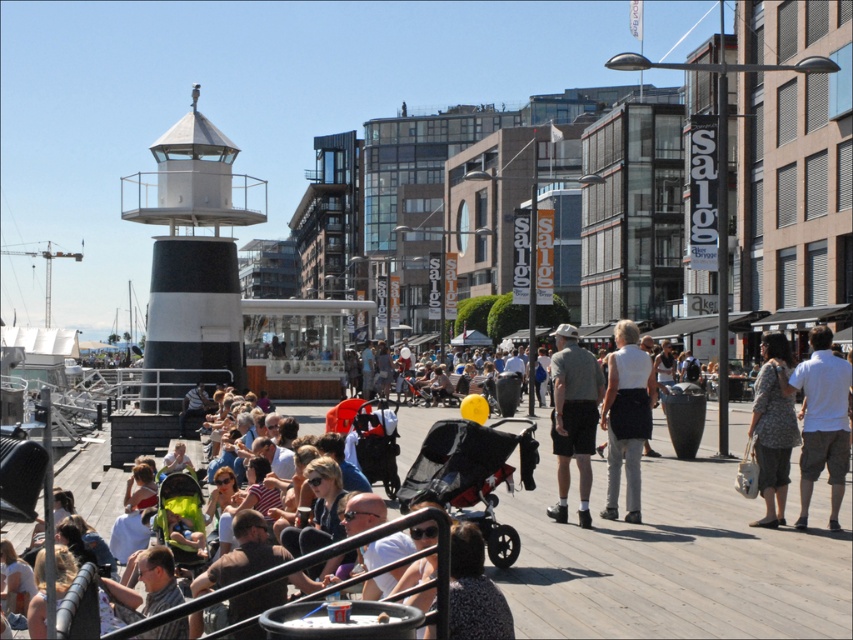
You are standing at point (821, 419) and see a white cotton shirt at center. Is there any object between you and the white cotton shirt at center?

There is no object between you and the white cotton shirt at center because you are already at the point where the white cotton shirt at center is located.

You are a photographer positioned at the back of the crowd and want to take a photo of both the white cotton shirt at center and the patterned fabric dress at center. Which clothing item will be more visible in your photo?

The white cotton shirt at center is taller than the patterned fabric dress at center, so the white cotton shirt at center will be more visible in the photo.